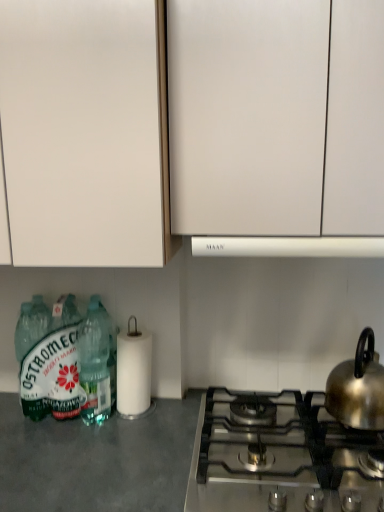
Find the location of a particular element. blank space above satin silver gas stove at lower right (from a real-world perspective) is located at coordinates (295, 425).